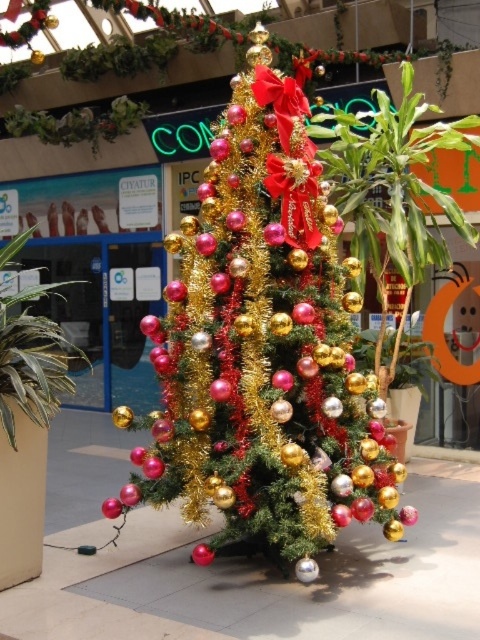
Which is behind, point (204, 307) or point (60, 376)?

Positioned behind is point (204, 307).

Which is behind, point (402, 531) or point (6, 392)?

The point (402, 531) is behind.

Identify the location of shiny metallic christmas tree at center. The width and height of the screenshot is (480, 640). (264, 349).